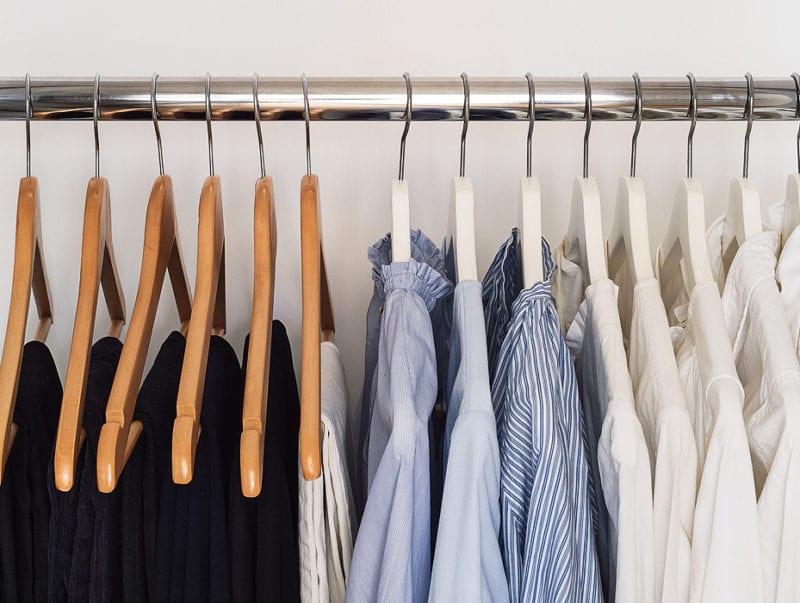
Find the location of a particular element. The height and width of the screenshot is (603, 800). white clothes hanger is located at coordinates (397, 233), (465, 227), (526, 227), (589, 226), (640, 226), (690, 224), (738, 218), (792, 185).